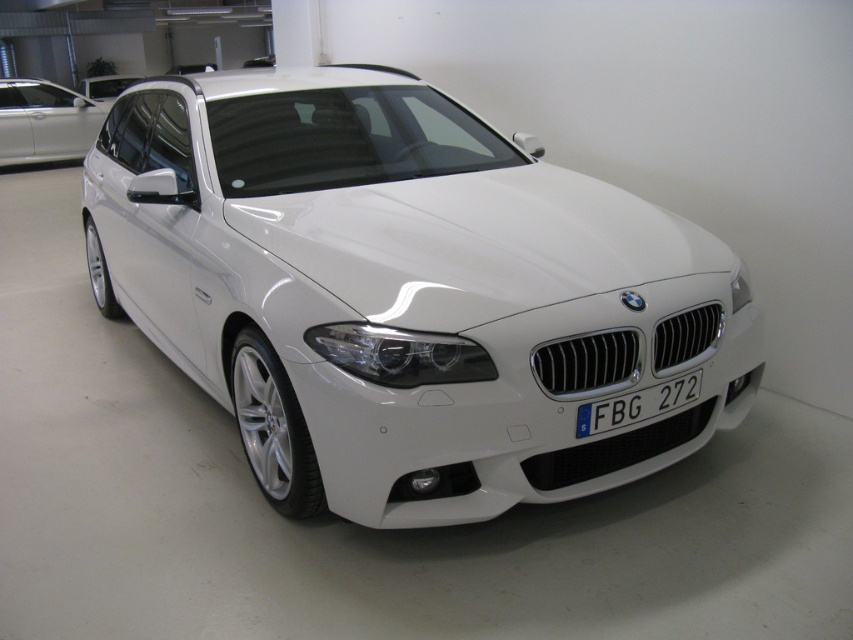
Who is positioned more to the left, satin silver car at upper left or white glossy car at upper center?

From the viewer's perspective, white glossy car at upper center appears more on the left side.

Where is `satin silver car at upper left`? The width and height of the screenshot is (853, 640). satin silver car at upper left is located at coordinates (44, 122).

Can you confirm if satin silver car at upper left is bigger than blue metallic license plate at center?

Yes, satin silver car at upper left is bigger than blue metallic license plate at center.

Can you confirm if satin silver car at upper left is positioned above blue metallic license plate at center?

Correct, satin silver car at upper left is located above blue metallic license plate at center.

The height and width of the screenshot is (640, 853). I want to click on satin silver car at upper left, so click(x=44, y=122).

Is white glossy car at center bigger than satin silver car at upper left?

Correct, white glossy car at center is larger in size than satin silver car at upper left.

Between point (229, 147) and point (61, 118), which one is positioned in front?

Point (229, 147) is more forward.

This screenshot has width=853, height=640. Identify the location of white glossy car at center. (405, 292).